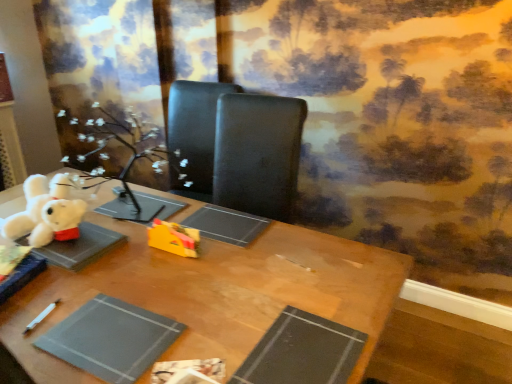
Where is `free area behind gray matte paper at lower left, which ranks as the 2th paperback book in right-to-left order`? This screenshot has height=384, width=512. free area behind gray matte paper at lower left, which ranks as the 2th paperback book in right-to-left order is located at coordinates (132, 276).